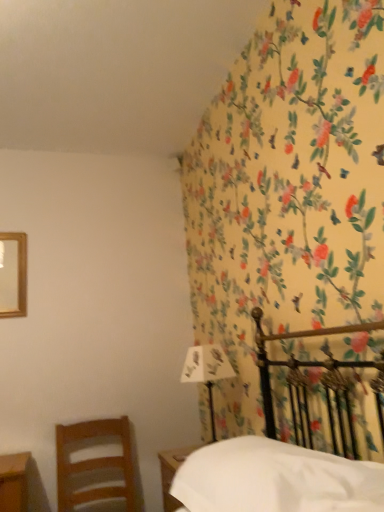
Locate an element on the screen. This screenshot has height=512, width=384. white matte sheet at lower right is located at coordinates (275, 479).

What is the approximate height of wooden chair at left?

The height of wooden chair at left is 20.17 inches.

What is the approximate width of white paper at upper right?

→ The width of white paper at upper right is 8.66 inches.

This screenshot has height=512, width=384. What do you see at coordinates (172, 473) in the screenshot?
I see `wooden nightstand at lower center` at bounding box center [172, 473].

What are the coordinates of `white matte sheet at lower right` in the screenshot? It's located at (275, 479).

Is wooden nightstand at lower center further to camera compared to white matte sheet at lower right?

Yes, it is.

From the image's perspective, which is below, wooden nightstand at lower center or white matte sheet at lower right?

From the image's view, wooden nightstand at lower center is below.

Which object is wider, wooden nightstand at lower center or white matte sheet at lower right?

Wider between the two is white matte sheet at lower right.

Are wooden nightstand at lower center and white matte sheet at lower right located far from each other?

They are positioned close to each other.

From the image's perspective, is wooden chair at left above or below wooden nightstand at lower center?

wooden chair at left is situated lower than wooden nightstand at lower center in the image.

From a real-world perspective, is wooden chair at left physically below wooden nightstand at lower center?

No, from a real-world perspective, wooden chair at left is not under wooden nightstand at lower center.

Is wooden chair at left positioned beyond the bounds of wooden nightstand at lower center?

Indeed, wooden chair at left is completely outside wooden nightstand at lower center.

From the image's perspective, is white matte sheet at lower right located above or below wooden chair at left?

white matte sheet at lower right is above wooden chair at left.

Is white matte sheet at lower right far from wooden chair at left?

white matte sheet at lower right is positioned a significant distance from wooden chair at left.

Which point is more distant from viewer, (260, 510) or (63, 438)?

Point (63, 438)

Is wooden chair at left positioned far away from white paper at upper right?

No, wooden chair at left is not far away from white paper at upper right.

Is wooden chair at left located outside white paper at upper right?

Yes, wooden chair at left is not within white paper at upper right.

Considering the sizes of objects wooden chair at left and white paper at upper right in the image provided, who is bigger, wooden chair at left or white paper at upper right?

With larger size is wooden chair at left.

From the image's perspective, is wooden chair at left above white paper at upper right?

No, from the image's perspective, wooden chair at left is not on top of white paper at upper right.

In the scene shown: Is wooden nightstand at lower center taller than wooden chair at left?

No.

Is wooden nightstand at lower center looking in the opposite direction of wooden chair at left?

That's not correct — wooden nightstand at lower center is not looking away from wooden chair at left.

From a real-world perspective, is wooden nightstand at lower center positioned under wooden chair at left based on gravity?

Yes, from a real-world perspective, wooden nightstand at lower center is under wooden chair at left.

Identify the location of nightstand below the wooden chair at left (from a real-world perspective). (172, 473).

From a real-world perspective, is white paper at upper right beneath wooden nightstand at lower center?

Incorrect, from a real-world perspective, white paper at upper right is higher than wooden nightstand at lower center.

Is white paper at upper right positioned with its back to wooden nightstand at lower center?

No, white paper at upper right's orientation is not away from wooden nightstand at lower center.

Identify the location of bedside lamp above the wooden nightstand at lower center (from a real-world perspective). The image size is (384, 512). (207, 371).

Is white paper at upper right wider than wooden nightstand at lower center?

Incorrect, the width of white paper at upper right does not surpass that of wooden nightstand at lower center.

From a real-world perspective, is wooden chair at left located higher than white matte sheet at lower right?

Incorrect, from a real-world perspective, wooden chair at left is lower than white matte sheet at lower right.

Is point (105, 458) positioned in front of point (206, 465)?

No, it is behind (206, 465).

Locate an element on the screen. The image size is (384, 512). chair below the white matte sheet at lower right (from the image's perspective) is located at coordinates (97, 463).

Identify the location of nightstand lying behind the white matte sheet at lower right. (172, 473).

Where is `chair on the left of wooden nightstand at lower center`? chair on the left of wooden nightstand at lower center is located at coordinates (97, 463).

Based on their spatial positions, is white paper at upper right or wooden nightstand at lower center closer to white matte sheet at lower right?

wooden nightstand at lower center is positioned closer to the anchor white matte sheet at lower right.

Estimate the real-world distances between objects in this image. Which object is closer to white paper at upper right, wooden chair at left or wooden nightstand at lower center?

wooden nightstand at lower center is closer to white paper at upper right.

Based on their spatial positions, is white paper at upper right or white matte sheet at lower right further from wooden nightstand at lower center?

Based on the image, white paper at upper right appears to be further to wooden nightstand at lower center.

Based on their spatial positions, is wooden nightstand at lower center or wooden chair at left closer to white paper at upper right?

The object closer to white paper at upper right is wooden nightstand at lower center.

Looking at the image, which one is located further to white matte sheet at lower right, wooden nightstand at lower center or wooden chair at left?

wooden chair at left is positioned further to the anchor white matte sheet at lower right.

Estimate the real-world distances between objects in this image. Which object is further from wooden chair at left, white matte sheet at lower right or white paper at upper right?

white matte sheet at lower right.

Which object lies nearer to the anchor point white paper at upper right, wooden chair at left or white matte sheet at lower right?

Among the two, wooden chair at left is located nearer to white paper at upper right.

Looking at the image, which one is located closer to wooden chair at left, wooden nightstand at lower center or white matte sheet at lower right?

wooden nightstand at lower center is positioned closer to the anchor wooden chair at left.

You are a GUI agent. You are given a task and a screenshot of the screen. Output one action in this format:
    pyautogui.click(x=<x>, y=<y>)
    Task: Click on the nightstand between white matte sheet at lower right and wooden chair at left in the front-back direction
    
    Given the screenshot: What is the action you would take?
    pyautogui.click(x=172, y=473)

Where is `nightstand between wooden chair at left and white paper at upper right from left to right`? This screenshot has height=512, width=384. nightstand between wooden chair at left and white paper at upper right from left to right is located at coordinates (172, 473).

What are the coordinates of `nightstand positioned between white matte sheet at lower right and white paper at upper right from near to far` in the screenshot? It's located at (172, 473).

This screenshot has height=512, width=384. What are the coordinates of `chair positioned between white matte sheet at lower right and white paper at upper right from near to far` in the screenshot? It's located at (97, 463).